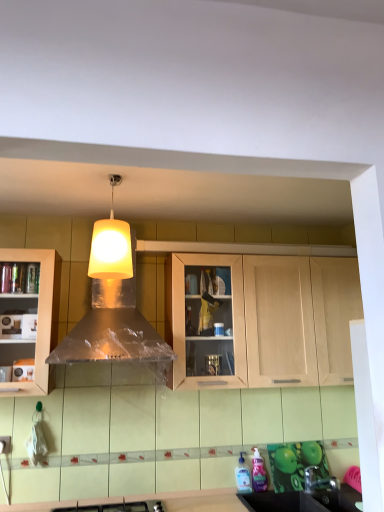
Question: Is translucent plastic bottle at lower center, which ranks as the second bottle in right-to-left order, to the right of white matte lampshade at upper center from the viewer's perspective?

Choices:
 (A) no
 (B) yes

Answer: (B)

Question: Is translucent plastic bottle at lower center, which ranks as the second bottle in right-to-left order, turned away from white matte lampshade at upper center?

Choices:
 (A) yes
 (B) no

Answer: (B)

Question: Does translucent plastic bottle at lower center, positioned as the 1th bottle in left-to-right order, have a lesser height compared to white matte lampshade at upper center?

Choices:
 (A) no
 (B) yes

Answer: (B)

Question: From the image's perspective, is translucent plastic bottle at lower center, positioned as the 1th bottle in left-to-right order, below white matte lampshade at upper center?

Choices:
 (A) yes
 (B) no

Answer: (A)

Question: Does translucent plastic bottle at lower center, which ranks as the second bottle in right-to-left order, have a greater height compared to white matte lampshade at upper center?

Choices:
 (A) yes
 (B) no

Answer: (B)

Question: Can you confirm if translucent plastic bottle at lower center, positioned as the 1th bottle in left-to-right order, is wider than white matte lampshade at upper center?

Choices:
 (A) no
 (B) yes

Answer: (A)

Question: From the image's perspective, does black plastic sink at lower right appear higher than translucent plastic bottle at lower center, acting as the first bottle starting from the right?

Choices:
 (A) no
 (B) yes

Answer: (A)

Question: From a real-world perspective, is black plastic sink at lower right positioned over translucent plastic bottle at lower center, acting as the first bottle starting from the right, based on gravity?

Choices:
 (A) no
 (B) yes

Answer: (A)

Question: Can you confirm if black plastic sink at lower right is taller than translucent plastic bottle at lower center, acting as the first bottle starting from the right?

Choices:
 (A) no
 (B) yes

Answer: (A)

Question: Does black plastic sink at lower right have a lesser width compared to translucent plastic bottle at lower center, acting as the first bottle starting from the right?

Choices:
 (A) no
 (B) yes

Answer: (A)

Question: Can you confirm if black plastic sink at lower right is wider than translucent plastic bottle at lower center, acting as the first bottle starting from the right?

Choices:
 (A) no
 (B) yes

Answer: (B)

Question: Would you say black plastic sink at lower right is a long distance from translucent plastic bottle at lower center, the second bottle from the left?

Choices:
 (A) yes
 (B) no

Answer: (B)

Question: Is white matte lampshade at upper center inside light wood cabinet at center?

Choices:
 (A) no
 (B) yes

Answer: (A)